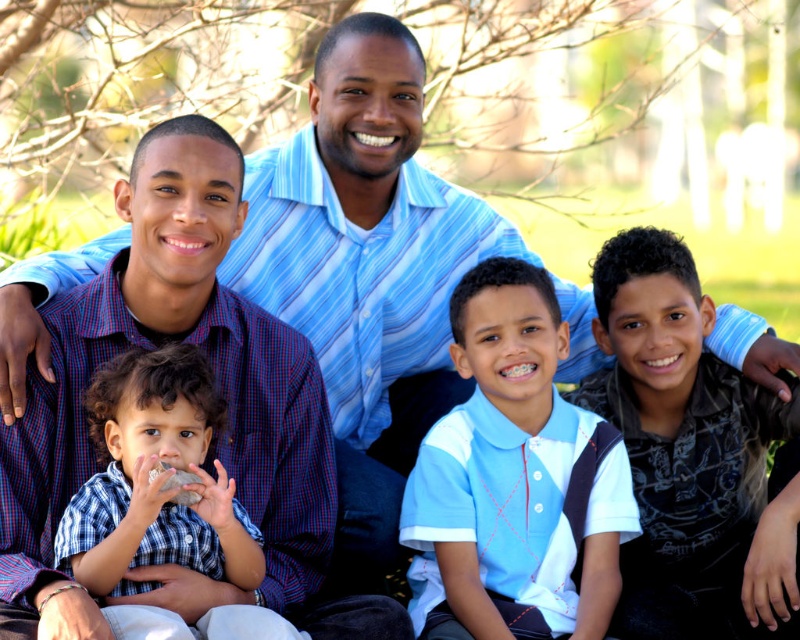
Question: Which point is farther to the camera?

Choices:
 (A) dark blue printed shirt at center
 (B) checkered fabric shirt at center

Answer: (A)

Question: Which of the following is the farthest from the observer?

Choices:
 (A) (520, 346)
 (B) (144, 586)
 (C) (678, 268)

Answer: (C)

Question: Can you confirm if dark blue printed shirt at center is bigger than checkered fabric shirt at center?

Choices:
 (A) no
 (B) yes

Answer: (B)

Question: Does light blue cotton polo shirt at center come behind checkered fabric shirt at center?

Choices:
 (A) no
 (B) yes

Answer: (B)

Question: Is dark blue printed shirt at center positioned at the back of checkered fabric shirt at center?

Choices:
 (A) yes
 (B) no

Answer: (A)

Question: Which point is closer to the camera?

Choices:
 (A) (672, 621)
 (B) (196, 518)

Answer: (B)